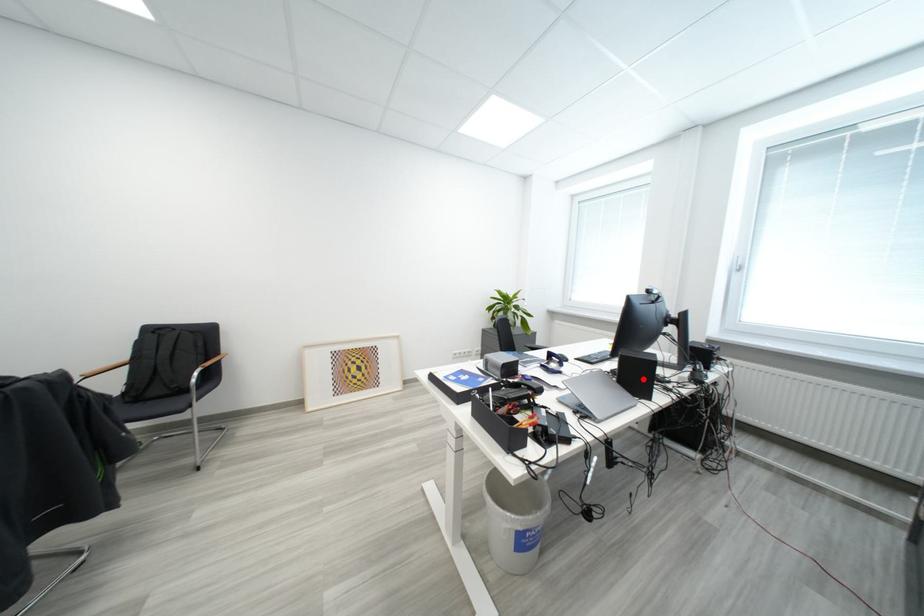
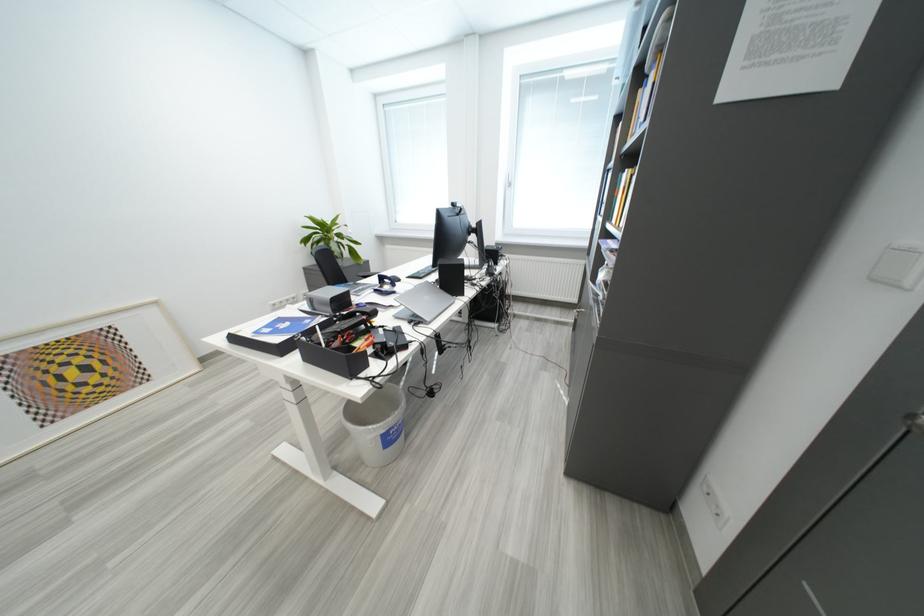
Locate, in the second image, the point that corresponds to the highlighted location in the first image.

(459, 283)